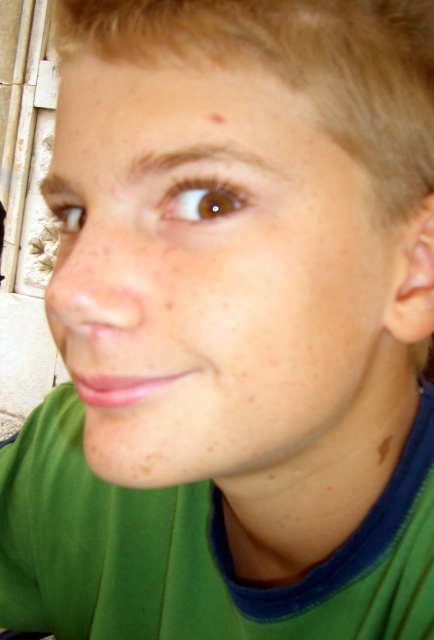
Question: Can you confirm if smooth skin face at center is bigger than brown matte freckle at lower right?

Choices:
 (A) no
 (B) yes

Answer: (B)

Question: Does smooth skin face at center appear over brown matte freckle at upper center?

Choices:
 (A) yes
 (B) no

Answer: (B)

Question: Which object is positioned closest to the smooth skin face at center?

Choices:
 (A) brown matte freckle at lower right
 (B) brown matte freckle at upper center

Answer: (B)

Question: Which point appears farthest from the camera in this image?

Choices:
 (A) (209, 116)
 (B) (101, 106)
 (C) (387, 444)

Answer: (C)

Question: Which of the following is the farthest from the observer?

Choices:
 (A) (211, 116)
 (B) (378, 456)
 (C) (131, 364)

Answer: (B)

Question: Does smooth skin face at center appear under brown matte freckle at lower right?

Choices:
 (A) yes
 (B) no

Answer: (B)